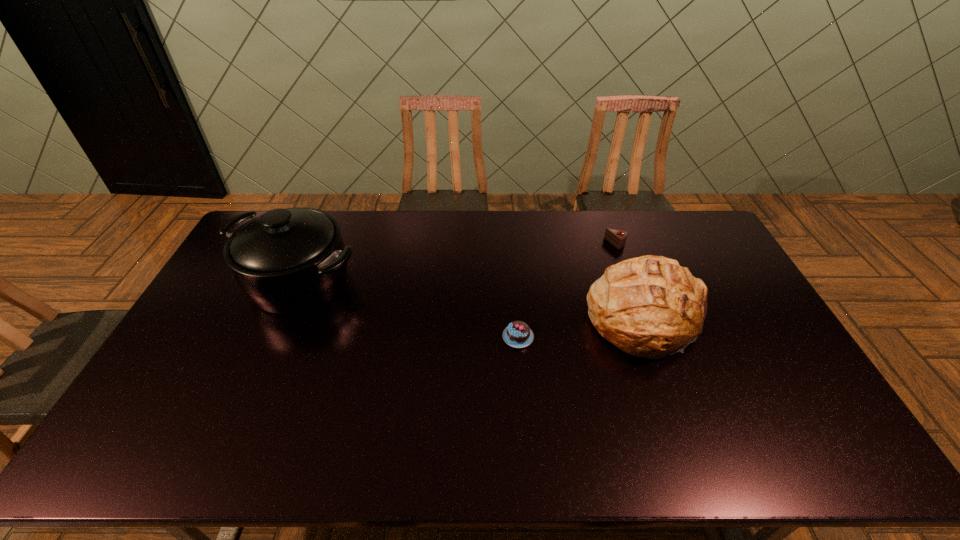
Identify the location of the tallest object. (287, 261).

The width and height of the screenshot is (960, 540). I want to click on saucepan, so click(x=287, y=261).

Find the location of a particular element. This screenshot has width=960, height=540. the third shortest object is located at coordinates click(650, 307).

At what (x,y) coordinates should I click in order to perform the action: click on the farther chocolate cake. Please return your answer as a coordinate pair (x, y). Looking at the image, I should click on (617, 238).

In order to click on the left chocolate cake in this screenshot , I will do `click(518, 334)`.

Locate an element on the screen. the third object from right to left is located at coordinates (518, 334).

Find the location of `vacant space situated 0.210m on the front of the saucepan`. vacant space situated 0.210m on the front of the saucepan is located at coordinates (258, 376).

Locate an element on the screen. vacant space situated 0.390m on the back of the bread is located at coordinates (609, 213).

Identify the location of vacant space positioned on the right of the farther chocolate cake. (659, 244).

The height and width of the screenshot is (540, 960). I want to click on free space located 0.370m on the right of the left chocolate cake, so click(x=658, y=336).